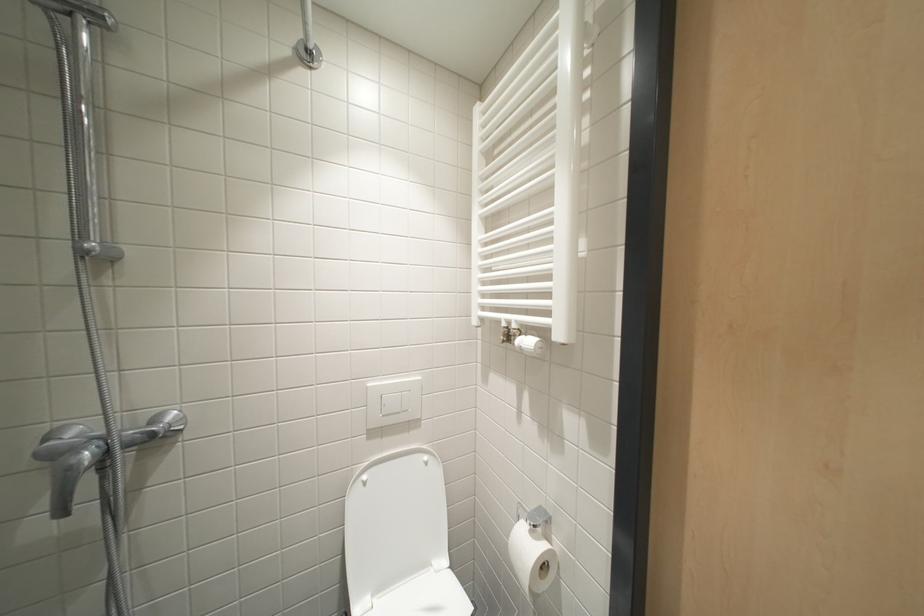
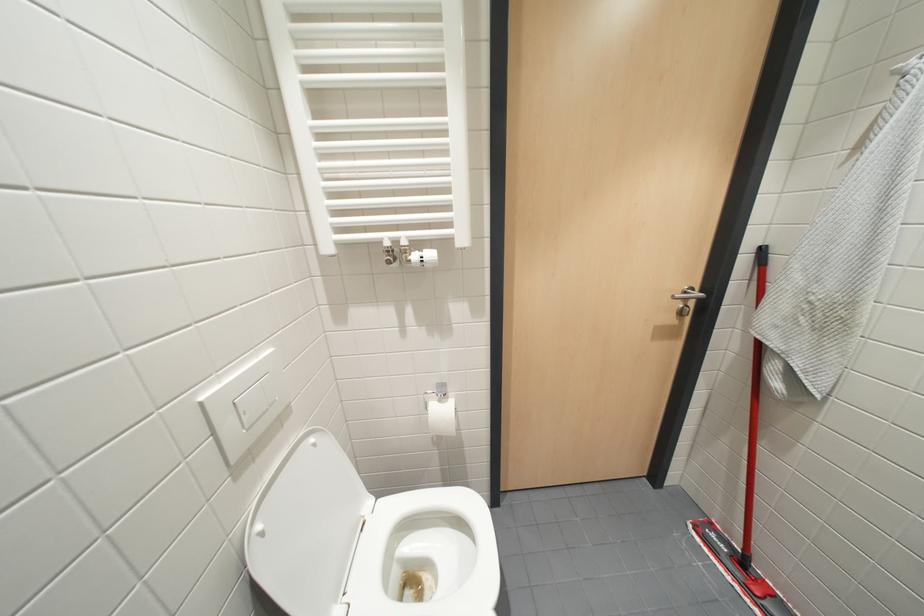
The images are taken continuously from a first-person perspective. In which direction is your viewpoint rotating?

The camera rotated toward right-down.